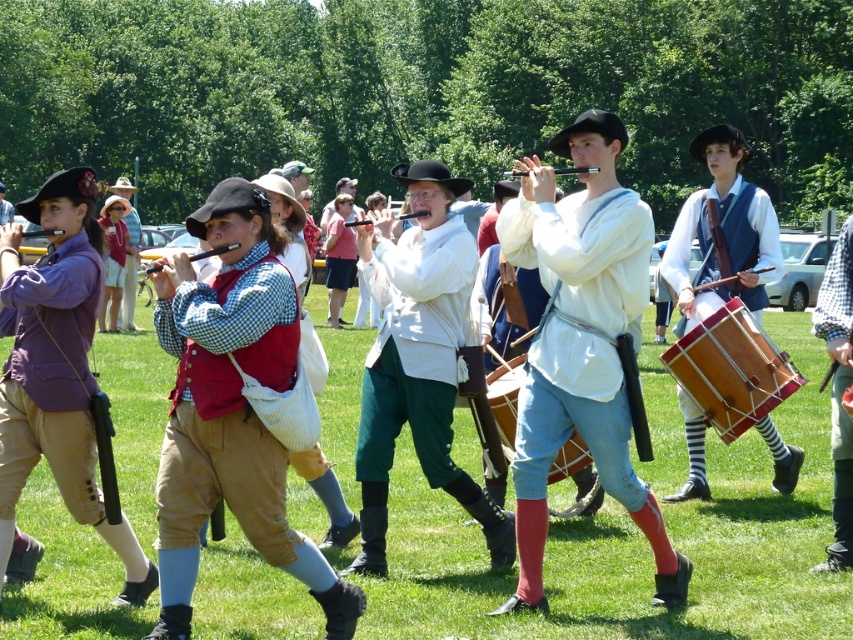
Is green grass at center further to the viewer compared to white cotton shirt at center?

No, it is in front of white cotton shirt at center.

Based on the photo, is green grass at center below white cotton shirt at center?

Yes, green grass at center is below white cotton shirt at center.

Who is more forward, (107, 353) or (460, 480)?

Point (460, 480)

You are a GUI agent. You are given a task and a screenshot of the screen. Output one action in this format:
    pyautogui.click(x=<x>, y=<y>)
    Task: Click on the green grass at center
    
    Given the screenshot: What is the action you would take?
    pyautogui.click(x=637, y=547)

Consider the image. Does green grass at center have a greater width compared to wooden drum at right?

Correct, the width of green grass at center exceeds that of wooden drum at right.

Can you confirm if green grass at center is positioned below wooden drum at right?

Yes, green grass at center is below wooden drum at right.

Is point (703, 589) positioned behind point (717, 397)?

No.

Find the location of a particular element. This screenshot has height=640, width=853. green grass at center is located at coordinates (637, 547).

Who is shorter, matte red vest at center or wooden drum at right?

matte red vest at center

Does matte red vest at center appear on the right side of wooden drum at right?

In fact, matte red vest at center is to the left of wooden drum at right.

Image resolution: width=853 pixels, height=640 pixels. Identify the location of matte red vest at center. (231, 406).

I want to click on matte red vest at center, so click(231, 406).